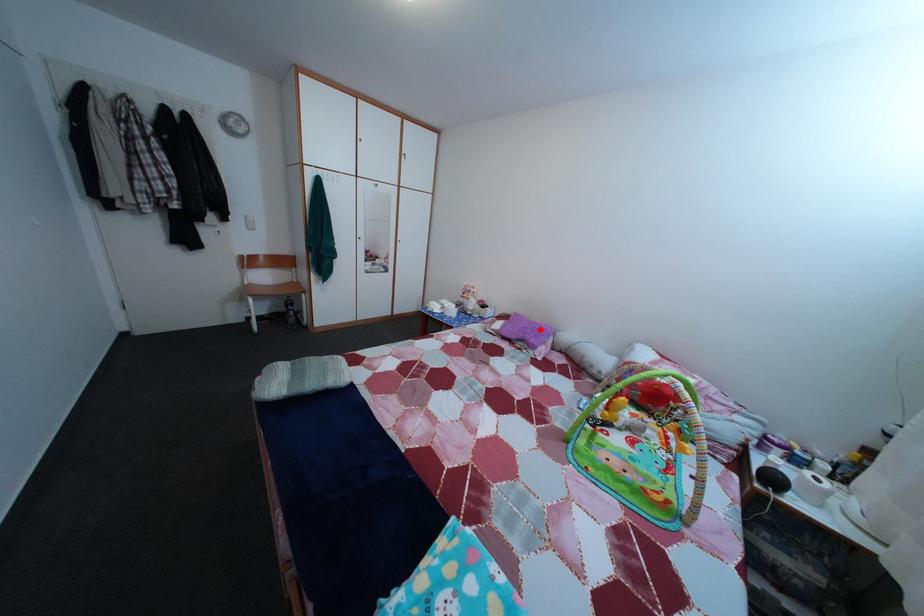
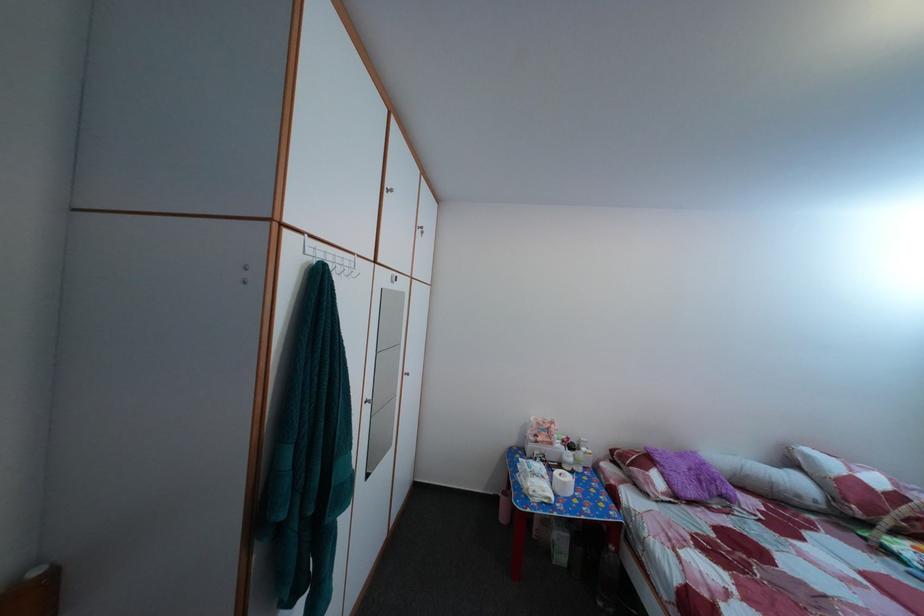
Where in the second image is the point corresponding to the highlighted location from the first image?

(689, 464)